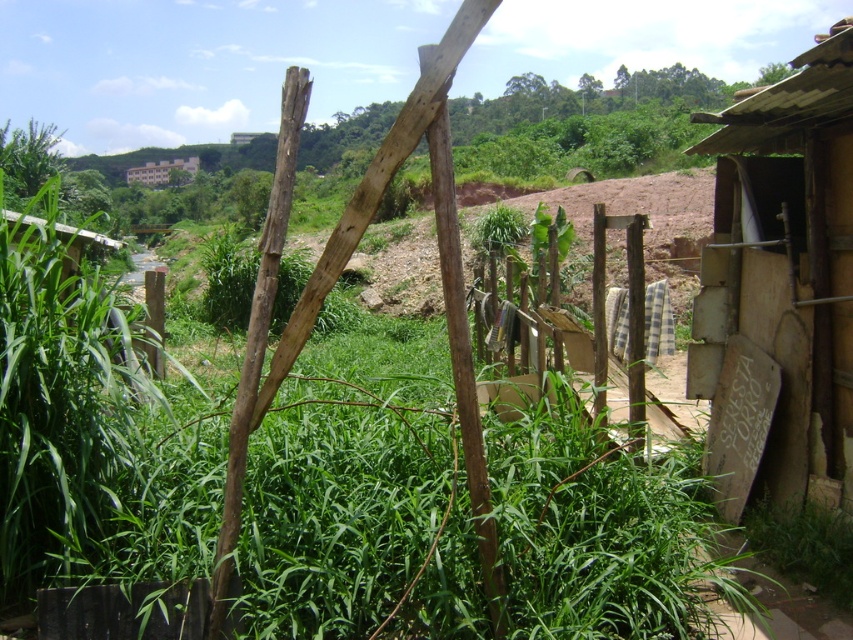
Can you confirm if wooden fence at center is smaller than brown wooden hut at upper center?

Yes, wooden fence at center is smaller than brown wooden hut at upper center.

Does point (608, 218) come in front of point (167, 180)?

Yes, it is in front of point (167, 180).

Does point (672, 435) come farther from viewer compared to point (131, 173)?

No, (672, 435) is in front of (131, 173).

Identify the location of wooden fence at center. (619, 330).

What are the coordinates of `wooden shack at right` in the screenshot? It's located at (780, 289).

Can you confirm if wooden shack at right is positioned to the left of wooden fence at center?

No, wooden shack at right is not to the left of wooden fence at center.

Is point (753, 440) in front of point (666, 330)?

Yes, it is.

Locate an element on the screen. wooden shack at right is located at coordinates (780, 289).

Who is higher up, wooden shack at right or brown wooden hut at upper center?

brown wooden hut at upper center is above.

Between wooden shack at right and brown wooden hut at upper center, which one has less height?

Standing shorter between the two is wooden shack at right.

This screenshot has width=853, height=640. What are the coordinates of `wooden shack at right` in the screenshot? It's located at (780, 289).